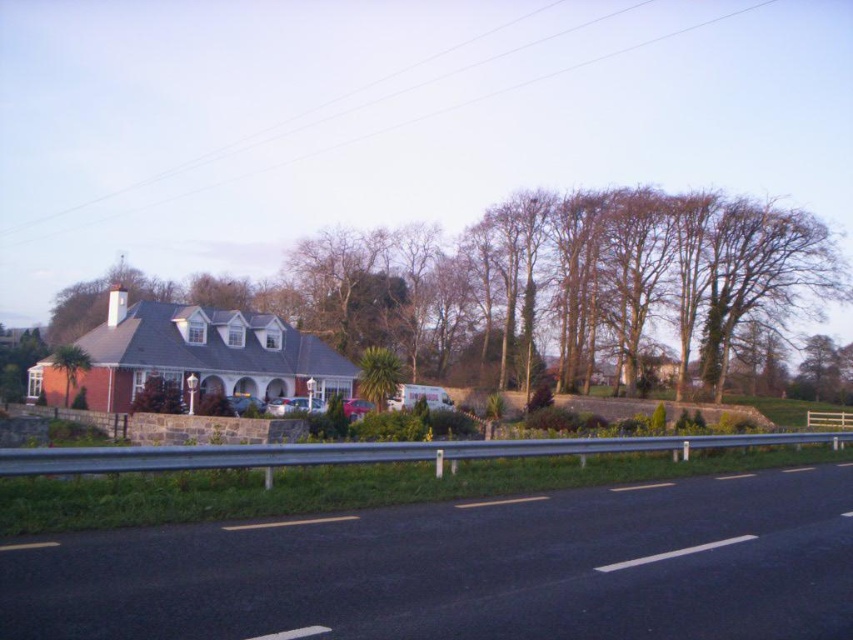
Does black asphalt road at lower center appear over green leafy tree at left?

Incorrect, black asphalt road at lower center is not positioned above green leafy tree at left.

Is point (653, 502) positioned before point (76, 352)?

That is True.

I want to click on black asphalt road at lower center, so click(x=468, y=570).

Measure the distance between brown textured tree at center and camera.

They are 48.29 meters apart.

Which is more to the right, brown textured tree at center or green leafy tree at left?

brown textured tree at center is more to the right.

Is point (759, 305) positioned after point (76, 358)?

Yes.

This screenshot has height=640, width=853. In order to click on brown textured tree at center in this screenshot , I will do `click(561, 285)`.

Does black asphalt road at lower center come in front of brown textured tree at center?

Yes, it is in front of brown textured tree at center.

Who is lower down, black asphalt road at lower center or brown textured tree at center?

black asphalt road at lower center is lower down.

Which is behind, point (405, 550) or point (432, 294)?

Point (432, 294)

This screenshot has height=640, width=853. What are the coordinates of `black asphalt road at lower center` in the screenshot? It's located at (468, 570).